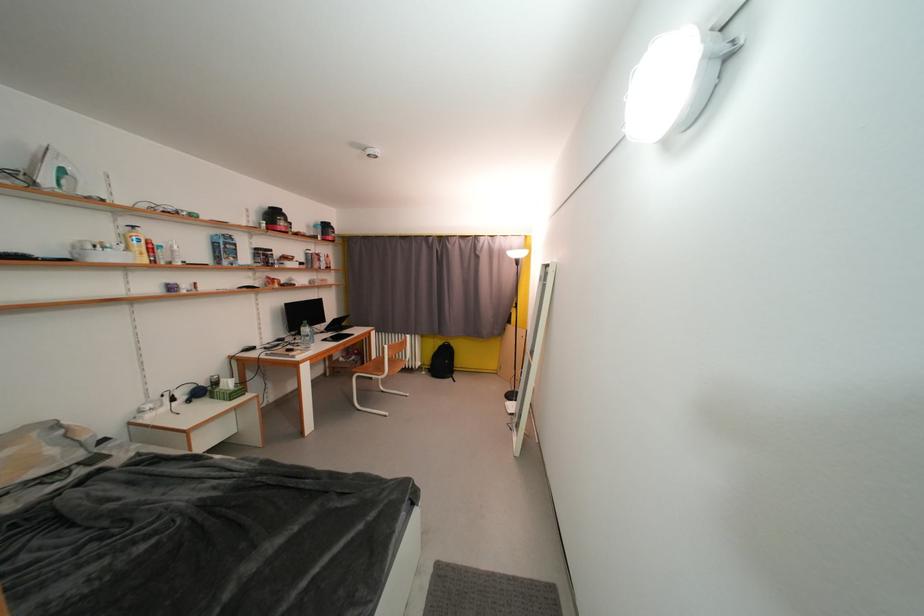
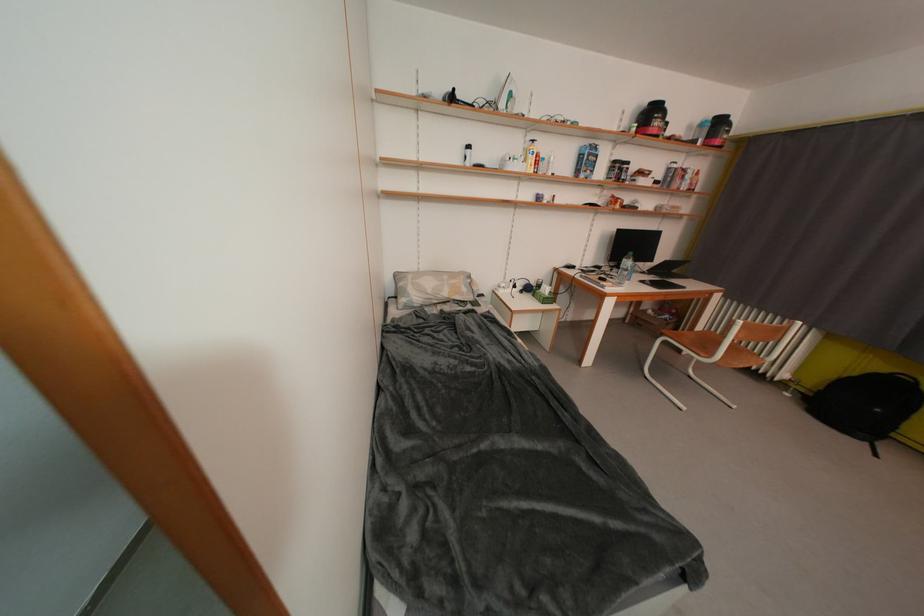
How did the camera likely rotate?

The rotation direction of the camera is left-down.